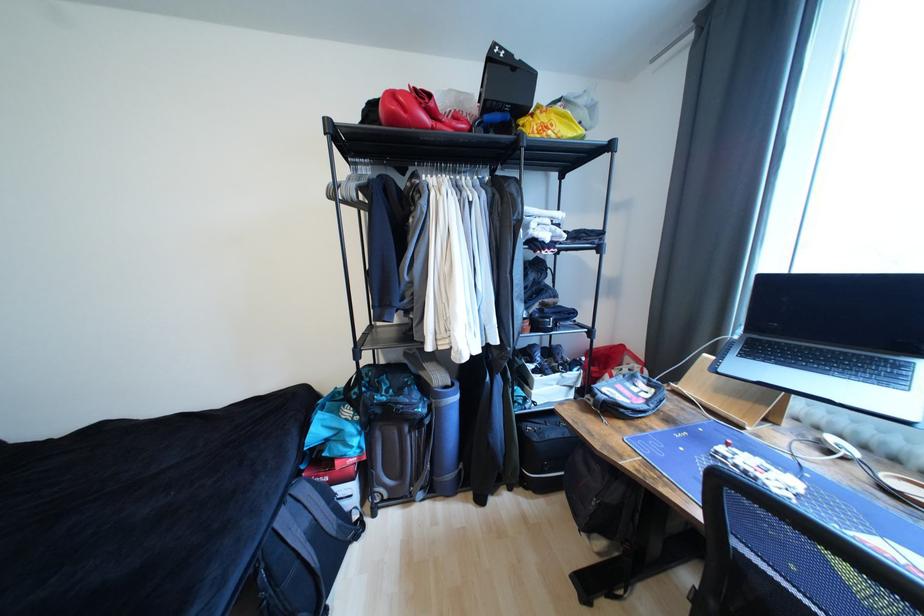
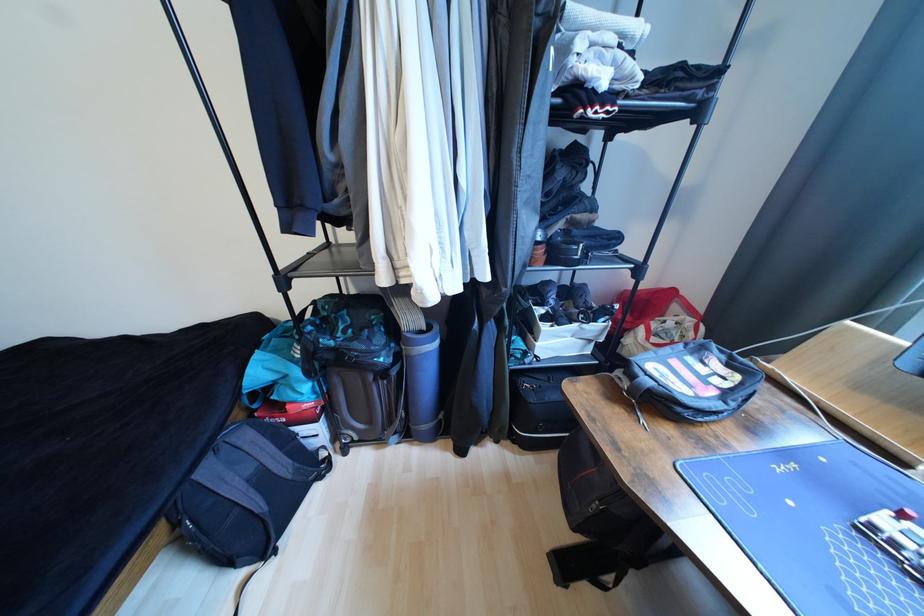
Question: I am providing you with two images of the same scene from different viewpoints. Please identify which objects are invisible in image2.

Choices:
 (A) suitcase handle
 (B) black backpack
 (C) small black bag
 (D) none of these

Answer: (D)